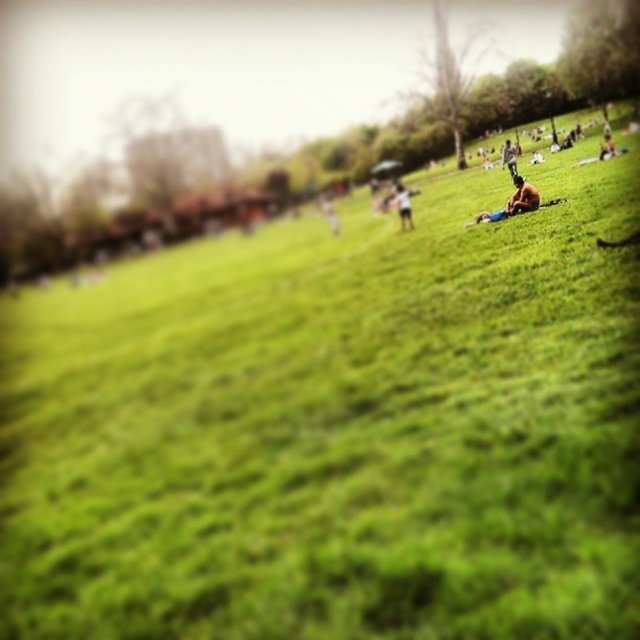
You are a photographer standing at the base of the hill. You want to take a clear photo of the brown textured shirt at center. Considering the camera you have can focus clearly up to 15 meters, will you be able to capture the shirt in focus?

The brown textured shirt at center is 18.67 meters away from the camera, which is beyond the camera focus range of 15 meters. Therefore, the shirt will not be in focus.

You are a photographer trying to capture a candid shot of the brown textured shirt at center and the light blue jeans at center. Which object should you adjust your camera focus to first if you want to ensure both are in frame?

The light blue jeans at center should be focused on first since the brown textured shirt at center is positioned to its right, ensuring both remain within the frame when adjusting focus.

You are standing at the base of the hill and want to place a 2 meter long ladder between the light blue jeans at center and the shiny metallic helmet at upper right. Is there enough space to place the ladder horizontally between them?

The distance between the light blue jeans at center and the shiny metallic helmet at upper right is 7.74 meters. Since the ladder is only 2 meters long, there is more than enough space to place it horizontally between them.